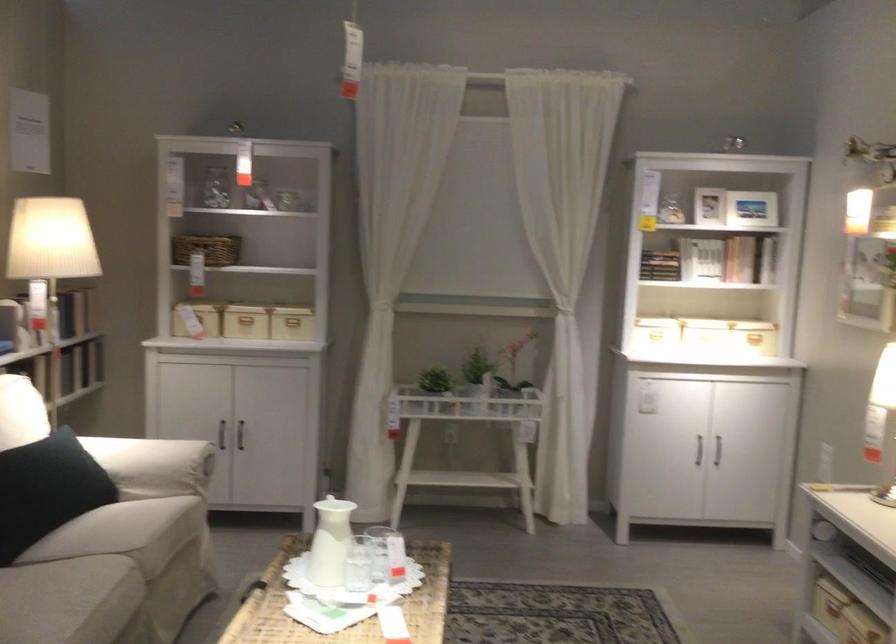
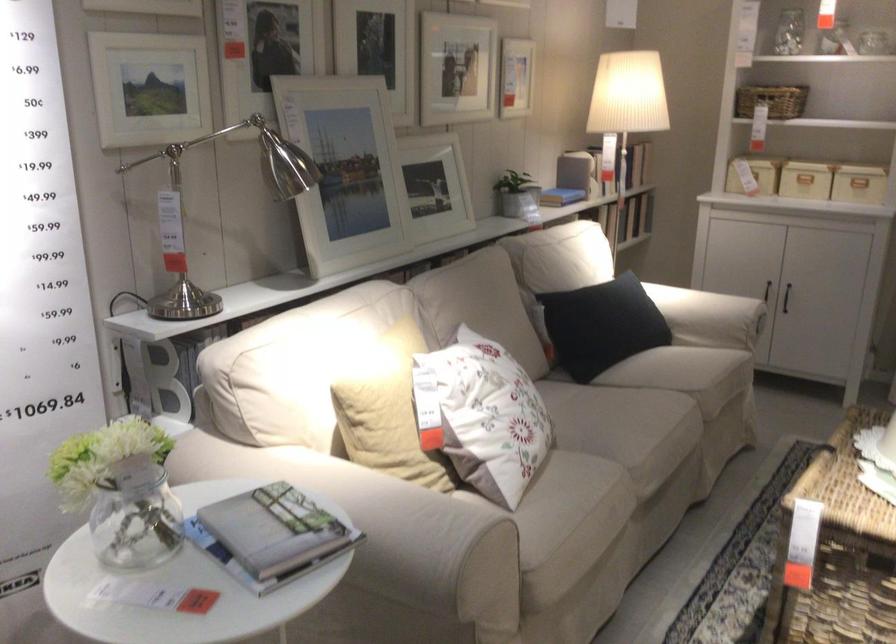
The point at (290,343) is marked in the first image. Where is the corresponding point in the second image?

(858, 184)